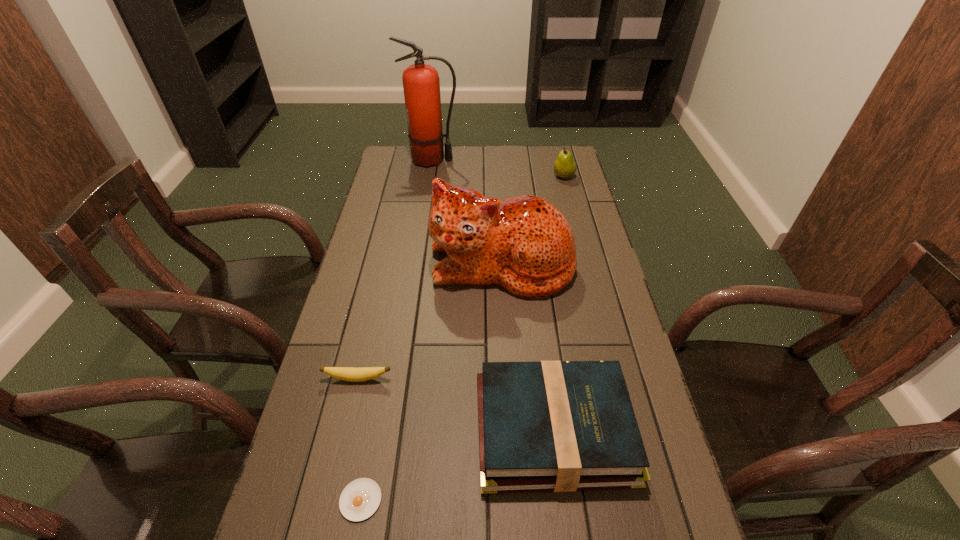
Locate an element on the screen. The image size is (960, 540). fire extinguisher is located at coordinates (421, 84).

Locate an element on the screen. This screenshot has height=540, width=960. the tallest object is located at coordinates (421, 84).

The height and width of the screenshot is (540, 960). In order to click on the third farthest object in this screenshot , I will do pyautogui.click(x=524, y=244).

At what (x,y) coordinates should I click in order to perform the action: click on cat. Please return your answer as a coordinate pair (x, y). The height and width of the screenshot is (540, 960). Looking at the image, I should click on (524, 244).

This screenshot has width=960, height=540. I want to click on the second farthest object, so click(564, 167).

You are a GUI agent. You are given a task and a screenshot of the screen. Output one action in this format:
    pyautogui.click(x=<x>, y=<y>)
    Task: Click on the pear
    The height and width of the screenshot is (540, 960).
    Given the screenshot: What is the action you would take?
    pyautogui.click(x=564, y=167)

The width and height of the screenshot is (960, 540). I want to click on hardback book, so click(563, 426).

You are a GUI agent. You are given a task and a screenshot of the screen. Output one action in this format:
    pyautogui.click(x=<x>, y=<y>)
    Task: Click on the second shortest object
    This screenshot has width=960, height=540.
    Given the screenshot: What is the action you would take?
    pyautogui.click(x=352, y=374)

At what (x,y) coordinates should I click in order to perform the action: click on egg yolk. Please return your answer as a coordinate pair (x, y). Looking at the image, I should click on (359, 500).

Find the location of a particular element. free space located on the nozzle of the fire extinguisher is located at coordinates (550, 160).